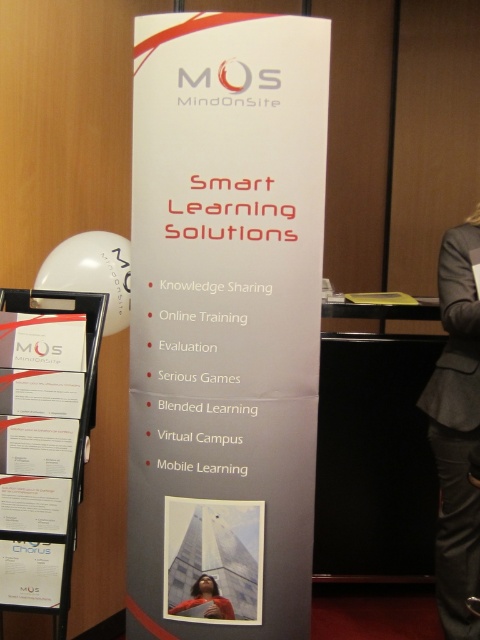
Question: Among these points, which one is farthest from the camera?

Choices:
 (A) (191, 563)
 (B) (455, 321)

Answer: (B)

Question: Which of these objects is positioned farthest from the red sweater at center?

Choices:
 (A) white paper at left
 (B) white paper at center

Answer: (B)

Question: Does white paper at left lie in front of matte red poster at center?

Choices:
 (A) yes
 (B) no

Answer: (A)

Question: Which point is closer to the camera?

Choices:
 (A) white paper at center
 (B) white paper at left

Answer: (A)

Question: Is white paper at left closer to camera compared to red sweater at center?

Choices:
 (A) yes
 (B) no

Answer: (A)

Question: Can you confirm if white paper at left is positioned to the left of red sweater at center?

Choices:
 (A) yes
 (B) no

Answer: (A)